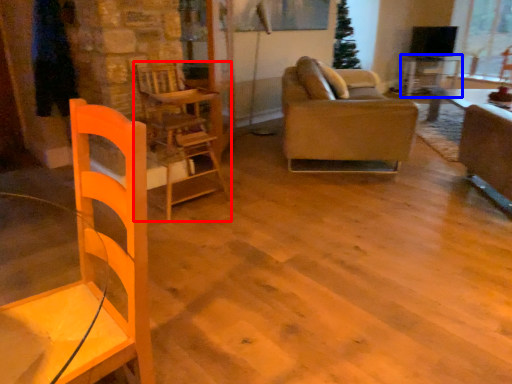
Question: Which object is closer to the camera taking this photo, chair (highlighted by a red box) or table (highlighted by a blue box)?

Choices:
 (A) chair
 (B) table

Answer: (A)